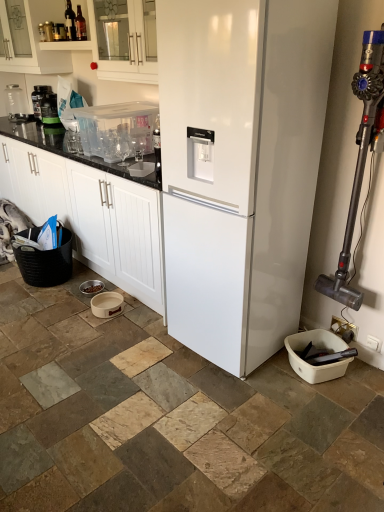
Question: Should I look upward or downward to see dark glass bottle at upper left?

Choices:
 (A) up
 (B) down

Answer: (A)

Question: Considering the relative sizes of metallic gray vacuum cleaner at right, arranged as the 7th appliance when viewed from the left, and white glossy cabinet at upper center, the second cabinetry positioned from the top, in the image provided, is metallic gray vacuum cleaner at right, arranged as the 7th appliance when viewed from the left, taller than white glossy cabinet at upper center, the second cabinetry positioned from the top,?

Choices:
 (A) yes
 (B) no

Answer: (A)

Question: Is the depth of metallic gray vacuum cleaner at right, which ranks as the first appliance in right-to-left order, less than that of white glossy cabinet at upper center, arranged as the 2th cabinetry when ordered from the bottom?

Choices:
 (A) yes
 (B) no

Answer: (A)

Question: From a real-world perspective, is metallic gray vacuum cleaner at right, arranged as the 7th appliance when viewed from the left, located beneath white glossy cabinet at upper center, the second cabinetry positioned from the top?

Choices:
 (A) yes
 (B) no

Answer: (A)

Question: From the image's perspective, would you say metallic gray vacuum cleaner at right, which ranks as the first appliance in right-to-left order, is shown under white glossy cabinet at upper center, arranged as the 2th cabinetry when ordered from the bottom?

Choices:
 (A) no
 (B) yes

Answer: (B)

Question: Can you confirm if metallic gray vacuum cleaner at right, which ranks as the first appliance in right-to-left order, is shorter than white glossy cabinet at upper center, the second cabinetry positioned from the top?

Choices:
 (A) yes
 (B) no

Answer: (B)

Question: From the image's perspective, does metallic gray vacuum cleaner at right, the 1th appliance in the front-to-back sequence, appear higher than white glossy cabinet at upper center, arranged as the 2th cabinetry when ordered from the bottom?

Choices:
 (A) yes
 (B) no

Answer: (B)

Question: Is black woven basket at lower left closer to camera compared to white glossy refrigerator at center?

Choices:
 (A) yes
 (B) no

Answer: (B)

Question: Does black woven basket at lower left have a greater width compared to white glossy refrigerator at center?

Choices:
 (A) yes
 (B) no

Answer: (B)

Question: Is black woven basket at lower left far away from white glossy refrigerator at center?

Choices:
 (A) yes
 (B) no

Answer: (A)

Question: Is black woven basket at lower left at the right side of white glossy refrigerator at center?

Choices:
 (A) no
 (B) yes

Answer: (A)

Question: Does black woven basket at lower left have a larger size compared to white glossy refrigerator at center?

Choices:
 (A) yes
 (B) no

Answer: (B)

Question: Is black woven basket at lower left taller than white glossy refrigerator at center?

Choices:
 (A) yes
 (B) no

Answer: (B)

Question: Can you confirm if white glossy cabinet at center, acting as the first cabinetry starting from the bottom, is shorter than clear plastic container at upper left, which is the 1th appliance in back-to-front order?

Choices:
 (A) yes
 (B) no

Answer: (B)